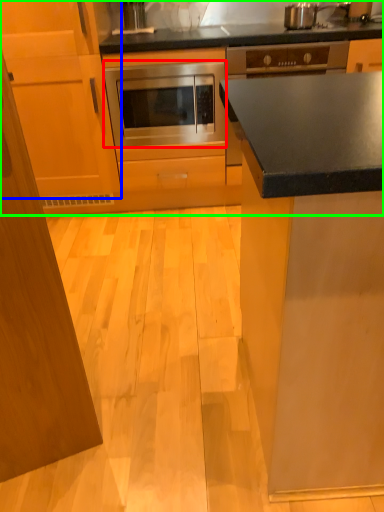
Question: Which is farther away from oven (highlighted by a red box)? cabinetry (highlighted by a blue box) or cabinetry (highlighted by a green box)?

Choices:
 (A) cabinetry
 (B) cabinetry

Answer: (A)